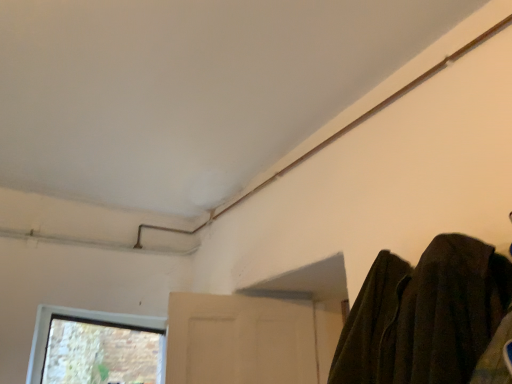
What are the coordinates of `dark brown fabric at lower right` in the screenshot? It's located at (424, 315).

What do you see at coordinates (424, 315) in the screenshot?
I see `dark brown fabric at lower right` at bounding box center [424, 315].

Measure the distance between dark brown fabric at lower right and camera.

36.10 inches.

Identify the location of dark brown fabric at lower right. (424, 315).